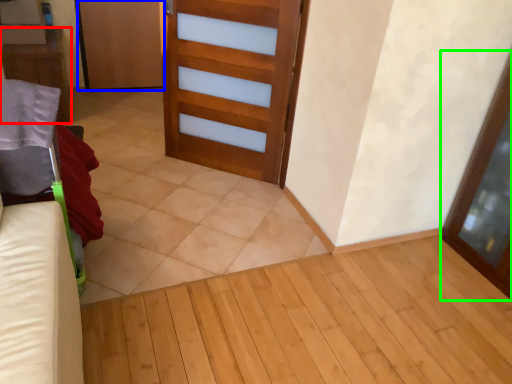
Question: Which is nearer to the furniture (highlighted by a red box)? door (highlighted by a blue box) or screen door (highlighted by a green box).

Choices:
 (A) door
 (B) screen door

Answer: (A)